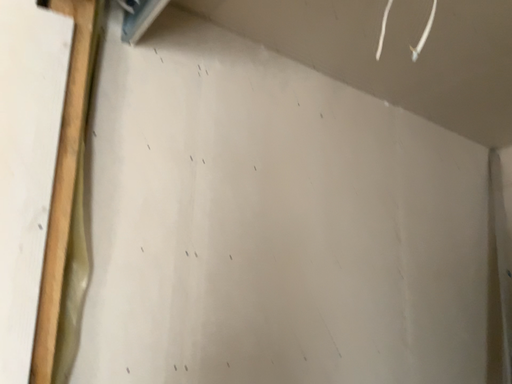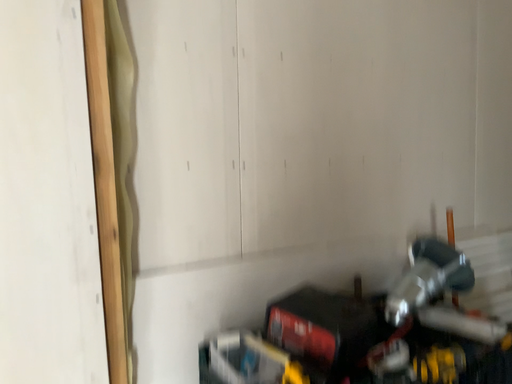
Question: Which way did the camera rotate in the video?

Choices:
 (A) rotated upward
 (B) rotated downward

Answer: (B)